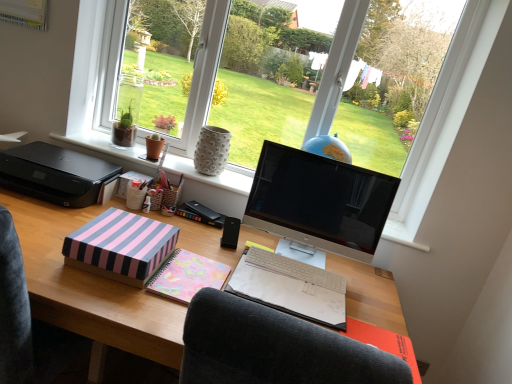
Question: From a real-world perspective, is pastel pink paper at lower right positioned above or below black plastic speaker at center?

Choices:
 (A) below
 (B) above

Answer: (A)

Question: From the image's perspective, is pastel pink paper at lower right located above or below black plastic speaker at center?

Choices:
 (A) above
 (B) below

Answer: (B)

Question: Which is farther from the pink striped cardboard box at center-left?

Choices:
 (A) white textured vase at center
 (B) pastel floral notebook at center
 (C) pastel pink paper at lower right
 (D) white plastic keyboard at center
 (E) wooden desk at center

Answer: (C)

Question: Which of these objects is positioned closest to the pastel butterfly-patterned paper at center?

Choices:
 (A) white textured vase at center
 (B) sleek black monitor at center
 (C) white plastic keyboard at center
 (D) pink striped paper at center
 (E) pastel floral notebook at center

Answer: (E)